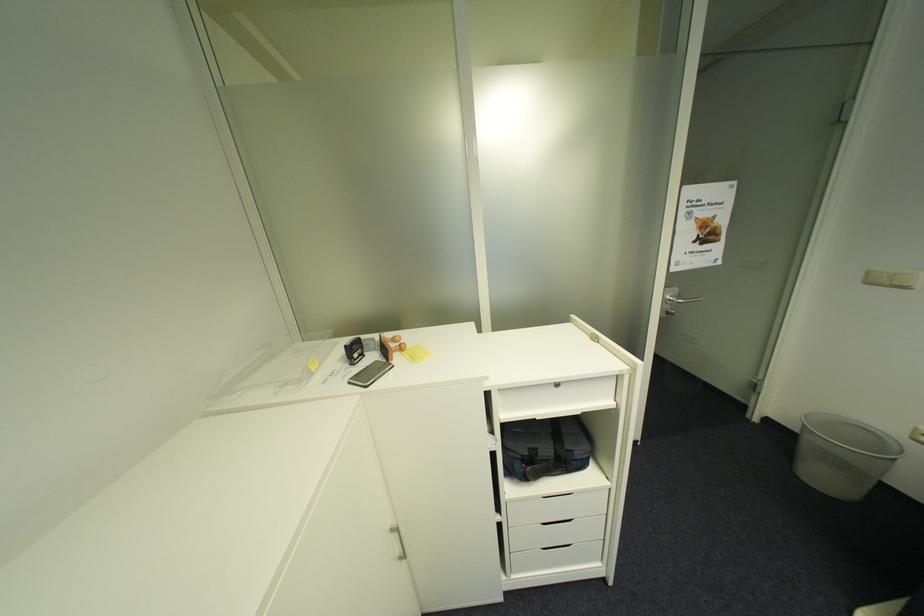
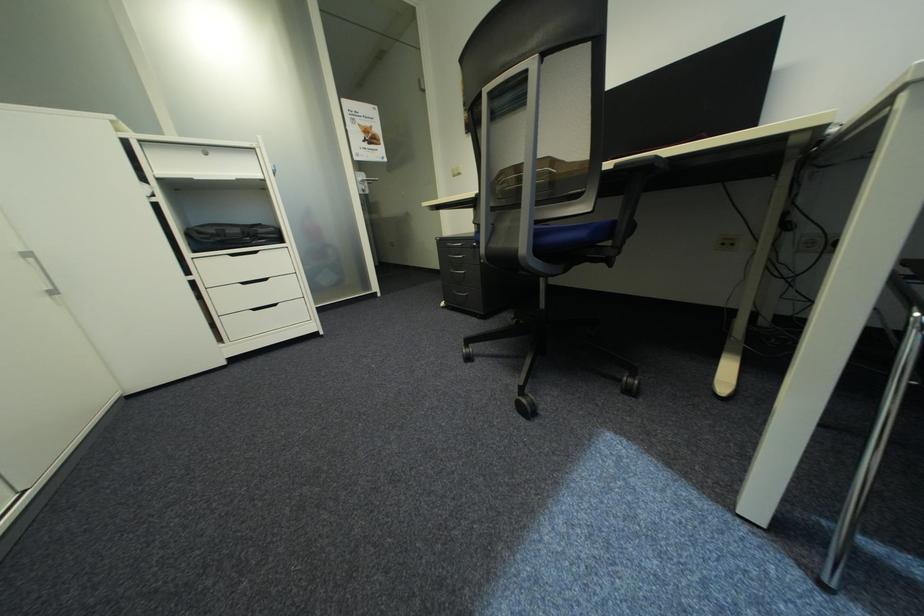
Find the pixel in the second image that matches (505,517) in the first image.

(199, 278)